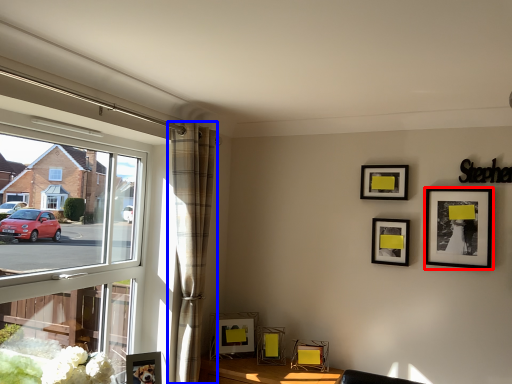
Question: Which object appears farthest to the camera in this image, picture frame (highlighted by a red box) or curtain (highlighted by a blue box)?

Choices:
 (A) picture frame
 (B) curtain

Answer: (A)